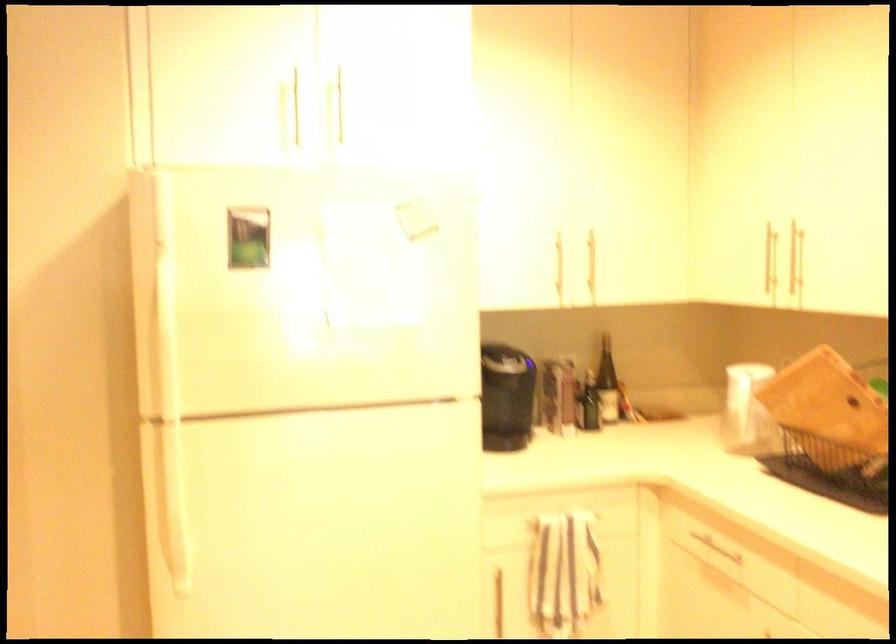
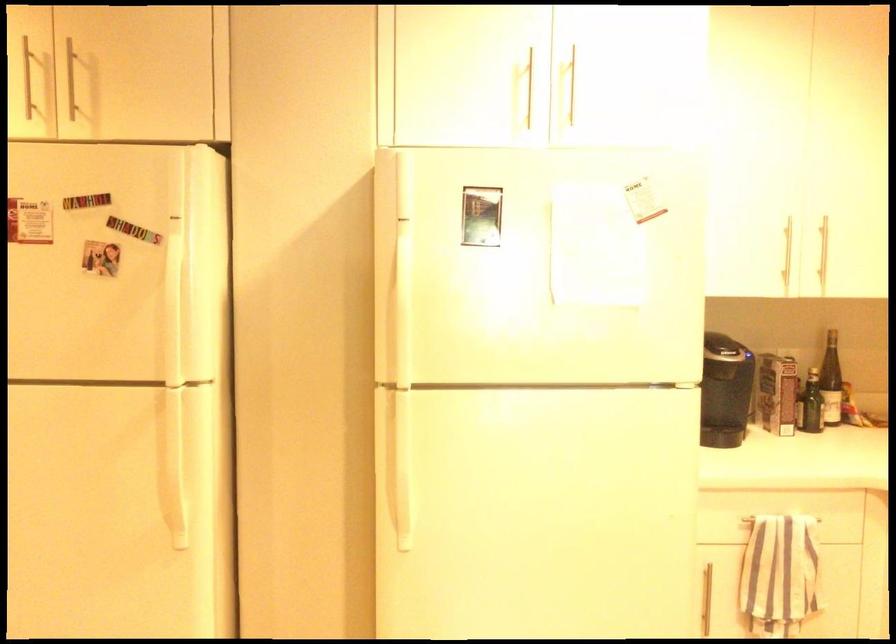
In the second image, find the point that corresponds to (x=165, y=502) in the first image.

(398, 460)